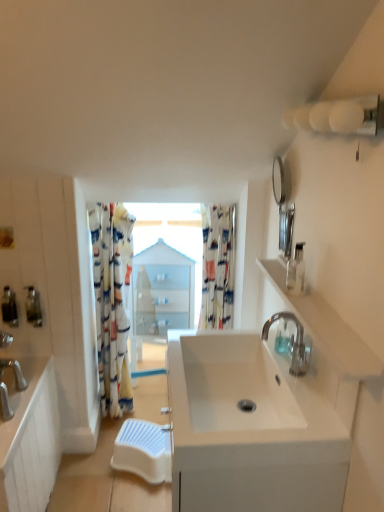
The width and height of the screenshot is (384, 512). In order to click on free spot in front of polished chrome faucet at center right in this screenshot , I will do `click(300, 400)`.